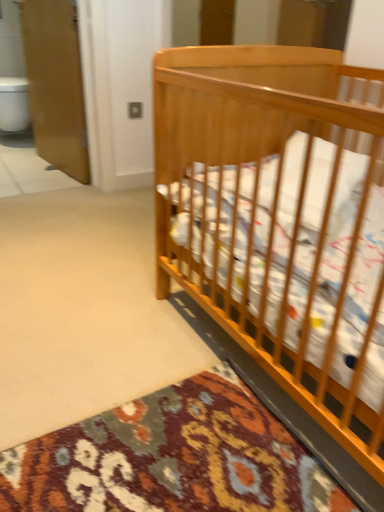
Question: From the image's perspective, is white glossy toilet bowl at left located above or below light brown wood crib at right?

Choices:
 (A) below
 (B) above

Answer: (B)

Question: In terms of size, does white glossy toilet bowl at left appear bigger or smaller than light brown wood crib at right?

Choices:
 (A) big
 (B) small

Answer: (B)

Question: Estimate the real-world distances between objects in this image. Which object is closer to the white glossy toilet bowl at left?

Choices:
 (A) wooden screen door at upper left
 (B) light brown wood crib at right
 (C) white tile at left

Answer: (C)

Question: Which object is positioned farthest from the white tile at left?

Choices:
 (A) light brown wood crib at right
 (B) wooden screen door at upper left
 (C) white glossy toilet bowl at left

Answer: (A)